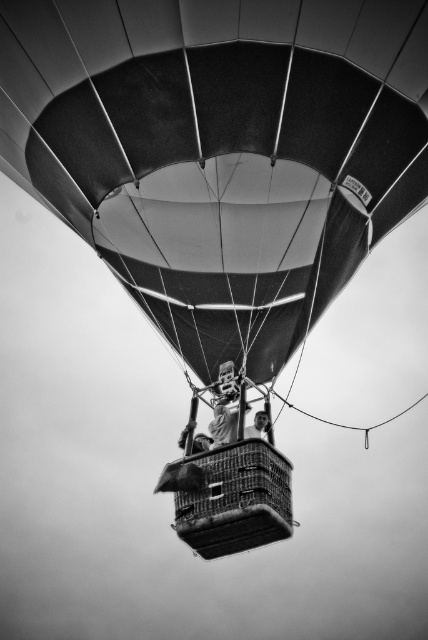
You are a photographer trying to capture a clear image of the smooth skin face at center while the matte black balloon at center is in the way. Can you adjust your position to avoid the balloon blocking the face?

The matte black balloon at center is in front of the smooth skin face at center, so you cannot adjust your position to avoid the balloon blocking the face without moving either the balloon or the face.

You are a passenger in the hot air balloon and want to look down at the metallic wire basket at center. However, your view is blocked by the smooth skin face at center. Can you move your head to the left or right to see the basket without moving your body?

The metallic wire basket at center is positioned under the smooth skin face at center, so moving your head to the left or right might allow you to see around the face and view the basket.

You are a photographer taking a picture of the metallic wire basket at center and the smooth skin face at center in the hot air balloon image. Which object should you focus on first if you want to capture both in sharp focus, considering their positions?

The metallic wire basket at center is to the left of smooth skin face at center, so you should focus on the metallic wire basket at center first as it is closer to the left side and adjust accordingly to ensure both are in focus.